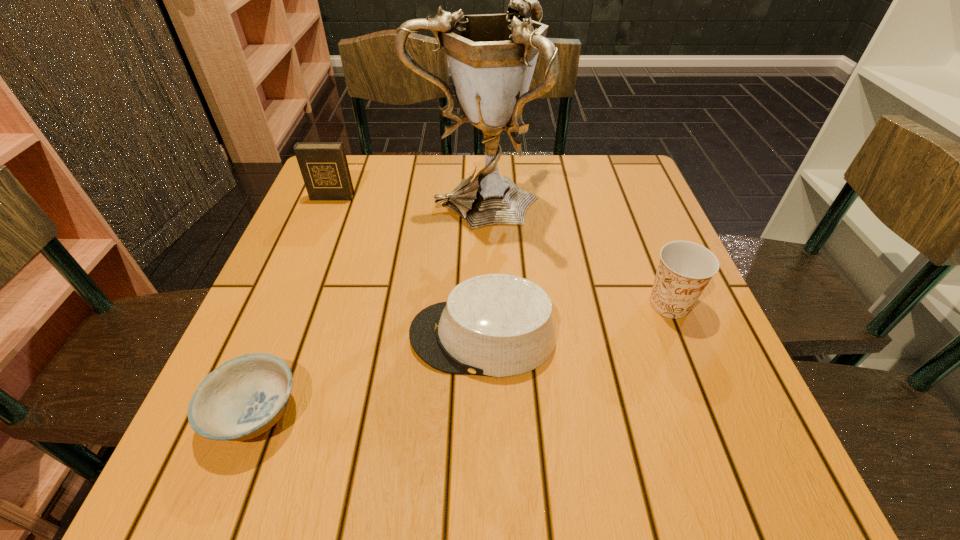
This screenshot has height=540, width=960. What are the coordinates of `free space located 0.190m on the front-facing side of the second shortest object` in the screenshot? It's located at (304, 336).

I want to click on vacant region located 0.270m on the front-facing side of the second shortest object, so click(260, 336).

Where is `vacant space located 0.080m on the right of the shortest object`? Image resolution: width=960 pixels, height=540 pixels. vacant space located 0.080m on the right of the shortest object is located at coordinates (352, 412).

Identify the location of trophy cup that is at the far edge. Image resolution: width=960 pixels, height=540 pixels. (492, 57).

Where is `diary present at the far edge`? This screenshot has height=540, width=960. diary present at the far edge is located at coordinates (323, 165).

Find the location of a particular element. The height and width of the screenshot is (540, 960). object at the near edge is located at coordinates (244, 397).

The height and width of the screenshot is (540, 960). I want to click on diary present at the left edge, so click(x=323, y=165).

The image size is (960, 540). I want to click on bowl positioned at the left edge, so click(x=244, y=397).

Locate an element on the screen. This screenshot has height=540, width=960. object situated at the right edge is located at coordinates (685, 268).

Locate an element on the screen. object that is at the far left corner is located at coordinates (323, 165).